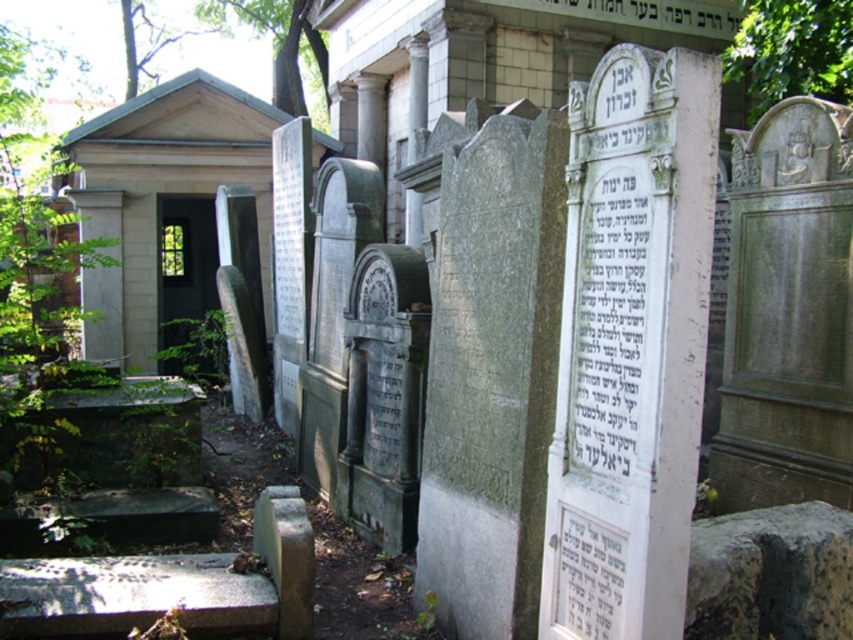
Is white stone gravestone at center shorter than gray stone gravestone at center?

Indeed, white stone gravestone at center has a lesser height compared to gray stone gravestone at center.

Between point (706, 200) and point (439, 348), which one is positioned behind?

The point (439, 348) is more distant.

Between point (645, 291) and point (500, 115), which one is positioned in front?

Point (645, 291) is in front.

Find the location of `white stone gravestone at center`. white stone gravestone at center is located at coordinates (630, 346).

Is gray stone tombstone at center wider than white paper at center?

Yes.

Identify the location of gray stone tombstone at center. (787, 312).

Who is more distant from viewer, (838, 237) or (567, 531)?

Point (838, 237)

Locate an element on the screen. This screenshot has height=640, width=853. gray stone tombstone at center is located at coordinates (787, 312).

Between white stone gravestone at center and black stone inscription at center, which one has less height?

With less height is black stone inscription at center.

Is point (677, 358) more distant than point (614, 307)?

No, it is not.

Find the location of a particular element. The width and height of the screenshot is (853, 640). white stone gravestone at center is located at coordinates (630, 346).